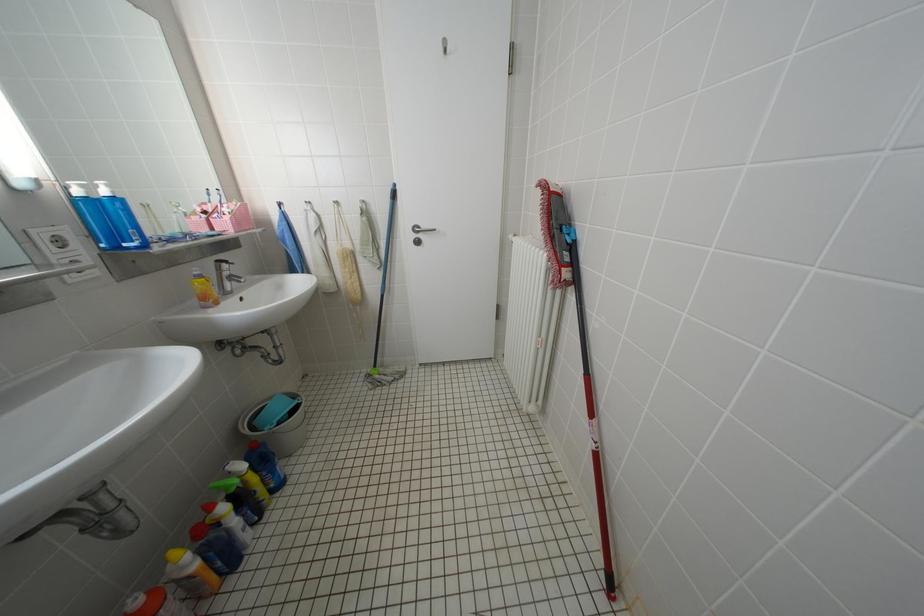
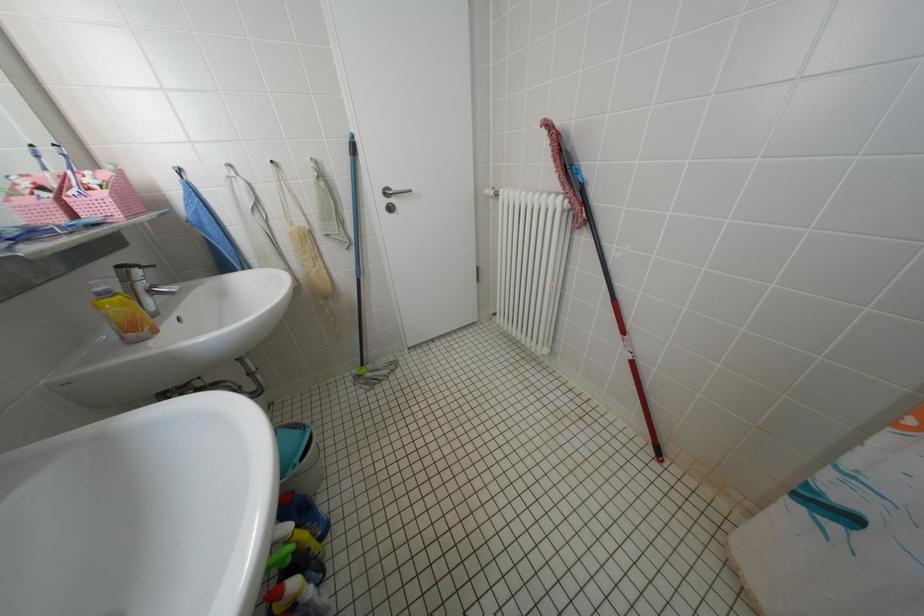
Question: Which direction would the cameraman need to move to produce the second image? Reply with the corresponding letter.

Choices:
 (A) Left
 (B) Right
 (C) Forward
 (D) Backward

Answer: (A)